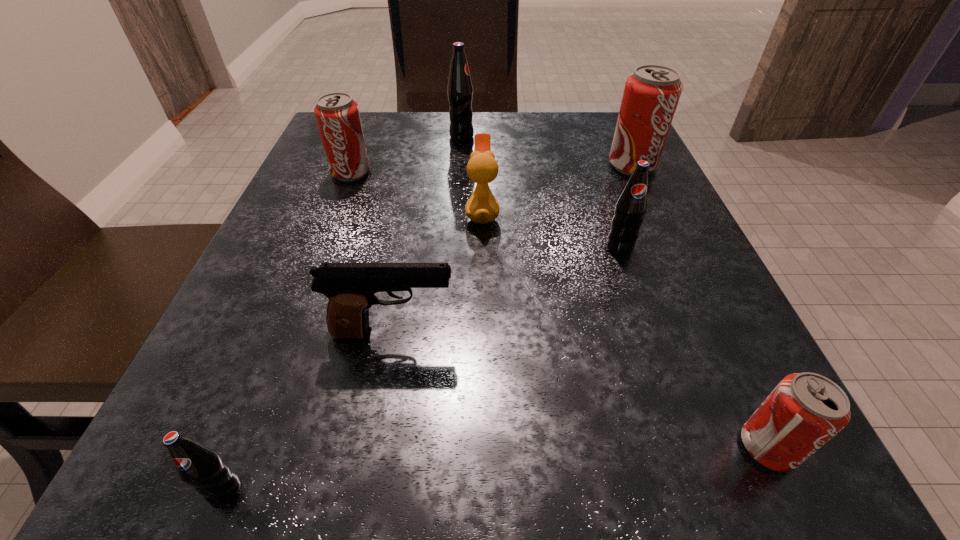
Find the location of `the nearest pink soda can`. the nearest pink soda can is located at coordinates (805, 410).

Where is `the smallest black pop`? The width and height of the screenshot is (960, 540). the smallest black pop is located at coordinates (199, 466).

Where is `the nearest black pop`? The height and width of the screenshot is (540, 960). the nearest black pop is located at coordinates (199, 466).

Where is `vacant area situated 0.090m on the front label of the fourth pop from right to left`? This screenshot has height=540, width=960. vacant area situated 0.090m on the front label of the fourth pop from right to left is located at coordinates (515, 137).

Find the location of a particular element. The height and width of the screenshot is (540, 960). free space located 0.140m on the back of the biggest pink soda can is located at coordinates (612, 123).

At what (x,y) coordinates should I click in order to perform the action: click on free spot located on the back of the second smallest pink soda can. Please return your answer as a coordinate pair (x, y). This screenshot has width=960, height=540. Looking at the image, I should click on (368, 128).

In order to click on blank space located 0.140m on the front label of the third nearest pop in this screenshot , I will do `click(646, 326)`.

Where is `vacant area located 0.190m at the barrel of the sixth farthest object`? vacant area located 0.190m at the barrel of the sixth farthest object is located at coordinates (595, 333).

Identify the location of vacant region located 0.230m on the beak of the tan duck. The height and width of the screenshot is (540, 960). (337, 213).

This screenshot has width=960, height=540. In order to click on vacant point located on the beak of the tan duck in this screenshot , I will do click(x=359, y=213).